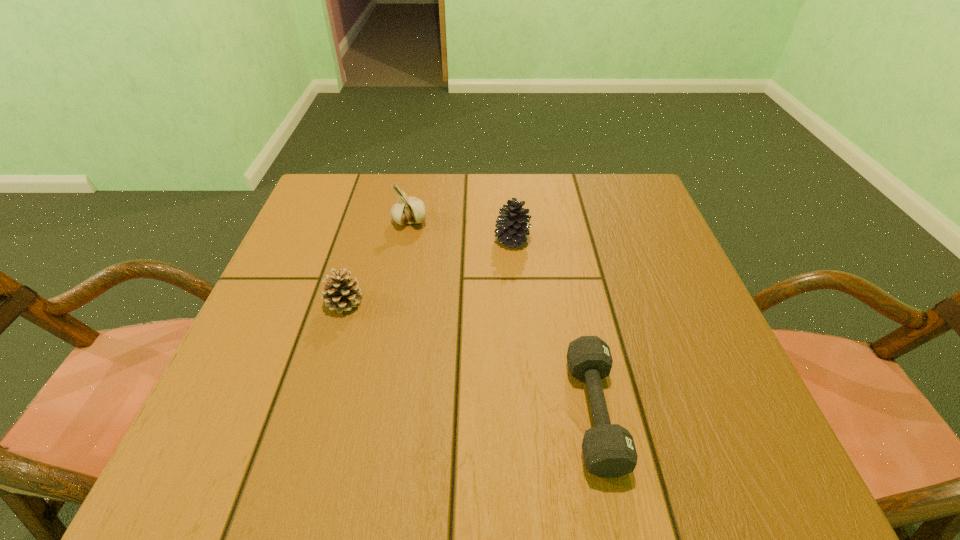
Identify which object is the second nearest to the leftmost object. Please provide its 2D coordinates. Your answer should be formatted as a tuple, i.e. [(x, y)], where the tuple contains the x and y coordinates of a point satisfying the conditions above.

[(513, 223)]

Identify which object is located as the second nearest to the garlic. Please provide its 2D coordinates. Your answer should be formatted as a tuple, i.e. [(x, y)], where the tuple contains the x and y coordinates of a point satisfying the conditions above.

[(341, 294)]

Image resolution: width=960 pixels, height=540 pixels. In order to click on vacant region that satisfies the following two spatial constraints: 1. on the back side of the second shortest object; 2. on the left side of the farther pinecone in this screenshot , I will do `click(363, 239)`.

The width and height of the screenshot is (960, 540). What are the coordinates of `blank space that satisfies the following two spatial constraints: 1. on the front side of the second object from left to right; 2. on the left side of the taller pinecone` in the screenshot? It's located at click(x=406, y=239).